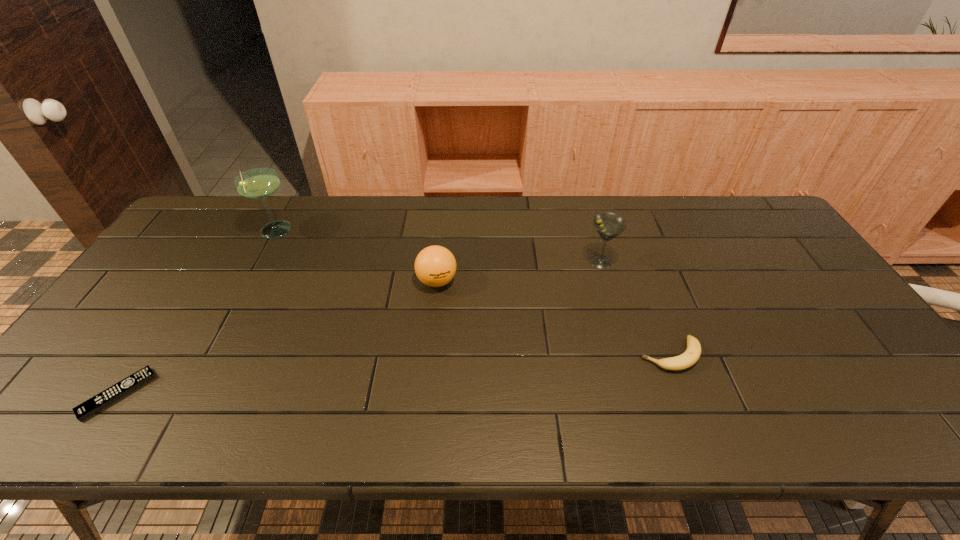
Where is `free space located on the right of the shorter martini`? free space located on the right of the shorter martini is located at coordinates (748, 262).

In order to click on vacant space located 0.280m on the side with brand of the third shortest object in this screenshot , I will do `click(426, 384)`.

Identify the location of free space located 0.170m on the back of the banana. This screenshot has width=960, height=540. (645, 290).

You are a GUI agent. You are given a task and a screenshot of the screen. Output one action in this format:
    pyautogui.click(x=<x>, y=<y>)
    Task: Click on the vacant space located 0.290m on the right of the leftmost object
    This screenshot has height=540, width=960.
    Given the screenshot: What is the action you would take?
    pyautogui.click(x=275, y=394)

Locate an element on the screen. object present at the far edge is located at coordinates (259, 183).

You are a GUI agent. You are given a task and a screenshot of the screen. Output one action in this format:
    pyautogui.click(x=<x>, y=<y>)
    Task: Click on the object located at the near edge
    The width and height of the screenshot is (960, 540).
    Given the screenshot: What is the action you would take?
    pyautogui.click(x=98, y=402)

Image resolution: width=960 pixels, height=540 pixels. In order to click on object that is positioned at the left edge in this screenshot , I will do `click(98, 402)`.

The image size is (960, 540). In order to click on object positioned at the near left corner in this screenshot , I will do `click(98, 402)`.

In the image, there is a desktop. What are the coordinates of `vacant space at the far edge` in the screenshot? It's located at (428, 199).

Locate an element on the screen. free region at the near edge of the desktop is located at coordinates (705, 434).